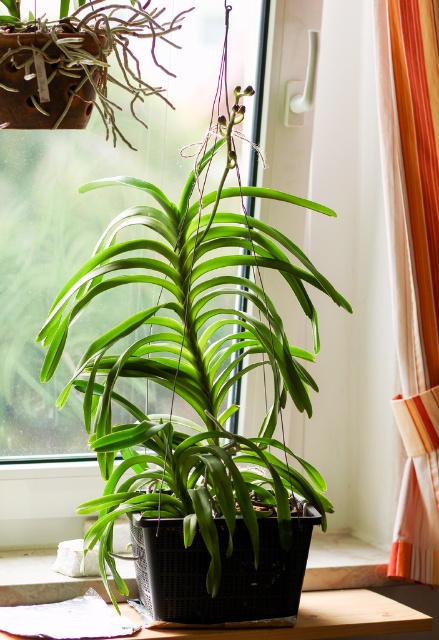
Question: Observing the image, what is the correct spatial positioning of transparent glass window at center in reference to rusty metal pot at upper left?

Choices:
 (A) above
 (B) below

Answer: (B)

Question: Which point is farther to the camera?

Choices:
 (A) green matte plant at center
 (B) rusty metal pot at upper left

Answer: (A)

Question: Estimate the real-world distances between objects in this image. Which object is farther from the green matte plant at center?

Choices:
 (A) rusty metal pot at upper left
 (B) transparent glass window at center
 (C) orange striped fabric at right

Answer: (C)

Question: Is green matte plant at center smaller than rusty metal pot at upper left?

Choices:
 (A) yes
 (B) no

Answer: (B)

Question: From the image, what is the correct spatial relationship of transparent glass window at center in relation to rusty metal pot at upper left?

Choices:
 (A) below
 (B) above

Answer: (A)

Question: Which of the following is the farthest from the observer?

Choices:
 (A) 168,61
 (B) 429,474
 (C) 259,467
 (D) 72,106

Answer: (A)